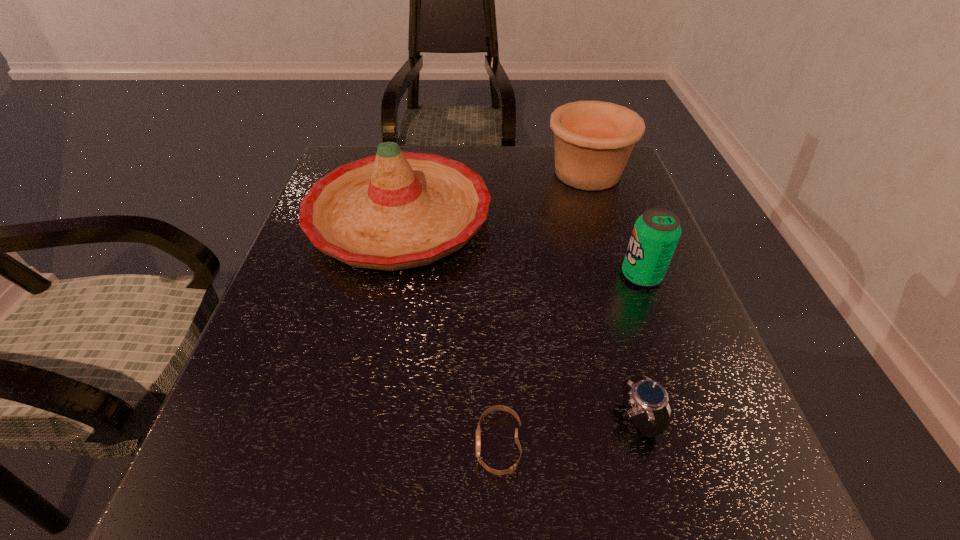
The height and width of the screenshot is (540, 960). Find the location of `sombrero`. sombrero is located at coordinates (395, 210).

Identify the location of pottery. Image resolution: width=960 pixels, height=540 pixels. (593, 140).

Image resolution: width=960 pixels, height=540 pixels. In order to click on pop soda in this screenshot , I will do `click(656, 233)`.

Find the location of `the taller watch`. the taller watch is located at coordinates (641, 394).

Locate an element on the screen. The image size is (960, 540). the right watch is located at coordinates (641, 394).

The width and height of the screenshot is (960, 540). I want to click on the left watch, so click(x=478, y=431).

Where is `the shorter watch`? the shorter watch is located at coordinates (478, 431).

Where is `vacant space located 0.110m on the front of the tallest object`? The width and height of the screenshot is (960, 540). vacant space located 0.110m on the front of the tallest object is located at coordinates pos(377,325).

At what (x,y) coordinates should I click in order to perform the action: click on vacant area located on the front of the pottery. Please return your answer as a coordinate pair (x, y). The height and width of the screenshot is (540, 960). Looking at the image, I should click on [x=613, y=254].

This screenshot has height=540, width=960. Find the location of `vacant area situated 0.330m on the front-facing side of the pop soda`. vacant area situated 0.330m on the front-facing side of the pop soda is located at coordinates (467, 275).